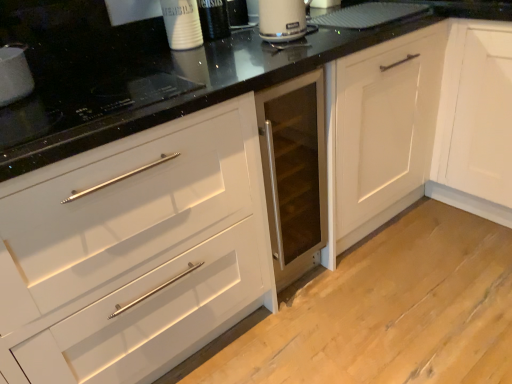
What do you see at coordinates (381, 130) in the screenshot?
I see `white matte cabinet at center` at bounding box center [381, 130].

Identify the location of matte white kettle at upper center. Image resolution: width=512 pixels, height=384 pixels. (282, 20).

Measure the distance between matte black induction cooktop at upper left, placed as the first appliance when sorted from left to right, and camera.

They are 1.07 meters apart.

The image size is (512, 384). In order to click on white matte cabinet at center in this screenshot , I will do `click(381, 130)`.

Is black glass cooktop at upper left, marked as the second appliance in a left-to-right arrangement, oriented towards matte black induction cooktop at upper left, placed as the first appliance when sorted from left to right?

No.

Could you measure the distance between black glass cooktop at upper left, which appears as the first appliance when viewed from the right, and matte black induction cooktop at upper left, placed as the first appliance when sorted from left to right?

The distance of black glass cooktop at upper left, which appears as the first appliance when viewed from the right, from matte black induction cooktop at upper left, placed as the first appliance when sorted from left to right, is 8.05 inches.

Considering the sizes of objects black glass cooktop at upper left, marked as the second appliance in a left-to-right arrangement, and matte black induction cooktop at upper left, placed as the first appliance when sorted from left to right, in the image provided, who is smaller, black glass cooktop at upper left, marked as the second appliance in a left-to-right arrangement, or matte black induction cooktop at upper left, placed as the first appliance when sorted from left to right,?

With smaller size is matte black induction cooktop at upper left, placed as the first appliance when sorted from left to right.

Which is behind, point (48, 142) or point (12, 66)?

The point (12, 66) is farther.

Is white matte cabinet at center outside of matte white kettle at upper center?

Yes.

Is white matte cabinet at center oriented towards matte white kettle at upper center?

Yes, white matte cabinet at center is turned towards matte white kettle at upper center.

Which is behind, point (431, 36) or point (305, 32)?

The point (305, 32) is more distant.

In the scene shown: Is white matte cabinet at center positioned far away from matte white kettle at upper center?

No, white matte cabinet at center is not far from matte white kettle at upper center.

From the image's perspective, is white matte cabinet at center on matte black induction cooktop at upper left, marked as the second appliance in a right-to-left arrangement?

Yes, from the image's perspective, white matte cabinet at center is above matte black induction cooktop at upper left, marked as the second appliance in a right-to-left arrangement.

Are white matte cabinet at center and matte black induction cooktop at upper left, marked as the second appliance in a right-to-left arrangement, making contact?

There is a gap between white matte cabinet at center and matte black induction cooktop at upper left, marked as the second appliance in a right-to-left arrangement.

Find the location of a particular element. This screenshot has width=512, height=384. appliance that is the 1st object located in front of the white matte cabinet at center is located at coordinates (14, 74).

Between white matte cabinet at center and matte black induction cooktop at upper left, placed as the first appliance when sorted from left to right, which one has smaller size?

matte black induction cooktop at upper left, placed as the first appliance when sorted from left to right.

Does point (20, 66) appear closer or farther from the camera than point (131, 66)?

Point (20, 66).

Is matte black induction cooktop at upper left, placed as the first appliance when sorted from left to right, shorter than black glass cooktop at upper left, marked as the second appliance in a left-to-right arrangement?

In fact, matte black induction cooktop at upper left, placed as the first appliance when sorted from left to right, may be taller than black glass cooktop at upper left, marked as the second appliance in a left-to-right arrangement.

Who is bigger, matte black induction cooktop at upper left, marked as the second appliance in a right-to-left arrangement, or black glass cooktop at upper left, marked as the second appliance in a left-to-right arrangement?

With larger size is black glass cooktop at upper left, marked as the second appliance in a left-to-right arrangement.

Which object is closer to the camera, matte black induction cooktop at upper left, placed as the first appliance when sorted from left to right, or matte white kettle at upper center?

matte black induction cooktop at upper left, placed as the first appliance when sorted from left to right.

Is matte black induction cooktop at upper left, marked as the second appliance in a right-to-left arrangement, at the right side of matte white kettle at upper center?

No, matte black induction cooktop at upper left, marked as the second appliance in a right-to-left arrangement, is not to the right of matte white kettle at upper center.

Is matte black induction cooktop at upper left, marked as the second appliance in a right-to-left arrangement, facing away from matte white kettle at upper center?

No, matte black induction cooktop at upper left, marked as the second appliance in a right-to-left arrangement, is not facing away from matte white kettle at upper center.

Could you measure the distance between matte black induction cooktop at upper left, placed as the first appliance when sorted from left to right, and matte white kettle at upper center?

The distance of matte black induction cooktop at upper left, placed as the first appliance when sorted from left to right, from matte white kettle at upper center is 30.64 inches.

Is matte white kettle at upper center taller than black glass cooktop at upper left, which appears as the first appliance when viewed from the right?

Correct, matte white kettle at upper center is much taller as black glass cooktop at upper left, which appears as the first appliance when viewed from the right.

Is matte white kettle at upper center turned away from black glass cooktop at upper left, which appears as the first appliance when viewed from the right?

That's not correct — matte white kettle at upper center is not looking away from black glass cooktop at upper left, which appears as the first appliance when viewed from the right.

Is matte white kettle at upper center bigger than black glass cooktop at upper left, which appears as the first appliance when viewed from the right?

No.

The height and width of the screenshot is (384, 512). Find the location of `the 2nd appliance in front of the matte white kettle at upper center`. the 2nd appliance in front of the matte white kettle at upper center is located at coordinates pos(84,107).

Is matte black induction cooktop at upper left, marked as the second appliance in a right-to-left arrangement, facing away from white matte cabinet at center?

No, matte black induction cooktop at upper left, marked as the second appliance in a right-to-left arrangement,'s orientation is not away from white matte cabinet at center.

Considering the sizes of objects matte black induction cooktop at upper left, marked as the second appliance in a right-to-left arrangement, and white matte cabinet at center in the image provided, who is smaller, matte black induction cooktop at upper left, marked as the second appliance in a right-to-left arrangement, or white matte cabinet at center?

matte black induction cooktop at upper left, marked as the second appliance in a right-to-left arrangement, is smaller.

Considering their positions, is matte black induction cooktop at upper left, placed as the first appliance when sorted from left to right, located in front of or behind white matte cabinet at center?

matte black induction cooktop at upper left, placed as the first appliance when sorted from left to right, is in front of white matte cabinet at center.

Between point (5, 102) and point (347, 196), which one is positioned in front?

The point (5, 102) is closer to the camera.

Find the location of a particular element. appliance on the right of the matte black induction cooktop at upper left, placed as the first appliance when sorted from left to right is located at coordinates 84,107.

Identify the location of kitchen appliance to the left of white matte cabinet at center. (282, 20).

From the image, which object appears to be farther from black glass cooktop at upper left, which appears as the first appliance when viewed from the right, matte black induction cooktop at upper left, placed as the first appliance when sorted from left to right, or white matte cabinet at center?

white matte cabinet at center is positioned further to the anchor black glass cooktop at upper left, which appears as the first appliance when viewed from the right.

When comparing their distances from white matte cabinet at center, does matte white kettle at upper center or black glass cooktop at upper left, marked as the second appliance in a left-to-right arrangement, seem closer?

matte white kettle at upper center is closer to white matte cabinet at center.

Considering their positions, is white matte cabinet at center positioned closer to matte white kettle at upper center than black glass cooktop at upper left, which appears as the first appliance when viewed from the right?

white matte cabinet at center is positioned closer to the anchor matte white kettle at upper center.

Looking at the image, which one is located further to white matte cabinet at center, black glass cooktop at upper left, marked as the second appliance in a left-to-right arrangement, or matte black induction cooktop at upper left, marked as the second appliance in a right-to-left arrangement?

Among the two, matte black induction cooktop at upper left, marked as the second appliance in a right-to-left arrangement, is located further to white matte cabinet at center.

Looking at the image, which one is located further to matte black induction cooktop at upper left, marked as the second appliance in a right-to-left arrangement, black glass cooktop at upper left, marked as the second appliance in a left-to-right arrangement, or matte white kettle at upper center?

Among the two, matte white kettle at upper center is located further to matte black induction cooktop at upper left, marked as the second appliance in a right-to-left arrangement.

Considering their positions, is matte white kettle at upper center positioned further to white matte cabinet at center than matte black induction cooktop at upper left, placed as the first appliance when sorted from left to right?

matte black induction cooktop at upper left, placed as the first appliance when sorted from left to right, lies further to white matte cabinet at center than the other object.

Looking at the image, which one is located further to black glass cooktop at upper left, marked as the second appliance in a left-to-right arrangement, matte white kettle at upper center or matte black induction cooktop at upper left, marked as the second appliance in a right-to-left arrangement?

matte white kettle at upper center lies further to black glass cooktop at upper left, marked as the second appliance in a left-to-right arrangement, than the other object.

Considering their positions, is matte white kettle at upper center positioned further to matte black induction cooktop at upper left, placed as the first appliance when sorted from left to right, than black glass cooktop at upper left, which appears as the first appliance when viewed from the right?

matte white kettle at upper center is positioned further to the anchor matte black induction cooktop at upper left, placed as the first appliance when sorted from left to right.

At what (x,y) coordinates should I click in order to perform the action: click on appliance between matte black induction cooktop at upper left, marked as the second appliance in a right-to-left arrangement, and matte white kettle at upper center, in the horizontal direction. Please return your answer as a coordinate pair (x, y). The image size is (512, 384). Looking at the image, I should click on (84, 107).

You are a GUI agent. You are given a task and a screenshot of the screen. Output one action in this format:
    pyautogui.click(x=<x>, y=<y>)
    Task: Click on the kitchen appliance situated between black glass cooktop at upper left, which appears as the first appliance when viewed from the right, and white matte cabinet at center from left to right
    Image resolution: width=512 pixels, height=384 pixels.
    Given the screenshot: What is the action you would take?
    pyautogui.click(x=282, y=20)

Identify the location of kitchen appliance between matte black induction cooktop at upper left, placed as the first appliance when sorted from left to right, and white matte cabinet at center. This screenshot has width=512, height=384. click(x=282, y=20).

Find the location of a particular element. appliance between matte black induction cooktop at upper left, marked as the second appliance in a right-to-left arrangement, and white matte cabinet at center from left to right is located at coordinates (84, 107).